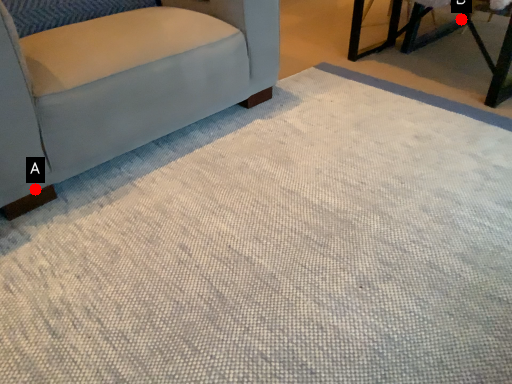
Question: Two points are circled on the image, labeled by A and B beside each circle. Among these points, which one is farthest from the camera?

Choices:
 (A) A is further
 (B) B is further

Answer: (B)